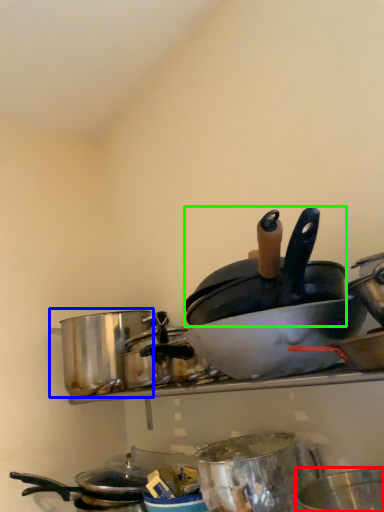
Question: Based on their relative distances, which object is farther from basin (highlighted by a red box)? Choose from crock pot (highlighted by a blue box) and frying pan (highlighted by a green box).

Choices:
 (A) crock pot
 (B) frying pan

Answer: (A)